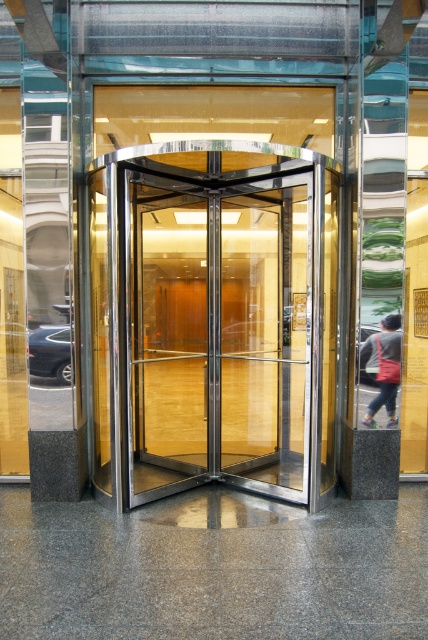
Question: Among these objects, which one is nearest to the camera?

Choices:
 (A) dark gray fabric jacket at right
 (B) transparent glass door at center

Answer: (B)

Question: Does transparent glass door at center appear under dark gray fabric jacket at right?

Choices:
 (A) no
 (B) yes

Answer: (A)

Question: Does transparent glass door at center appear on the right side of dark gray fabric jacket at right?

Choices:
 (A) yes
 (B) no

Answer: (B)

Question: Which point is farther from the camera taking this photo?

Choices:
 (A) [x=386, y=356]
 (B) [x=303, y=250]

Answer: (B)

Question: Which of the following is the farthest from the observer?

Choices:
 (A) (391, 355)
 (B) (270, 458)

Answer: (B)

Question: Is the position of transparent glass door at center more distant than that of dark gray fabric jacket at right?

Choices:
 (A) yes
 (B) no

Answer: (B)